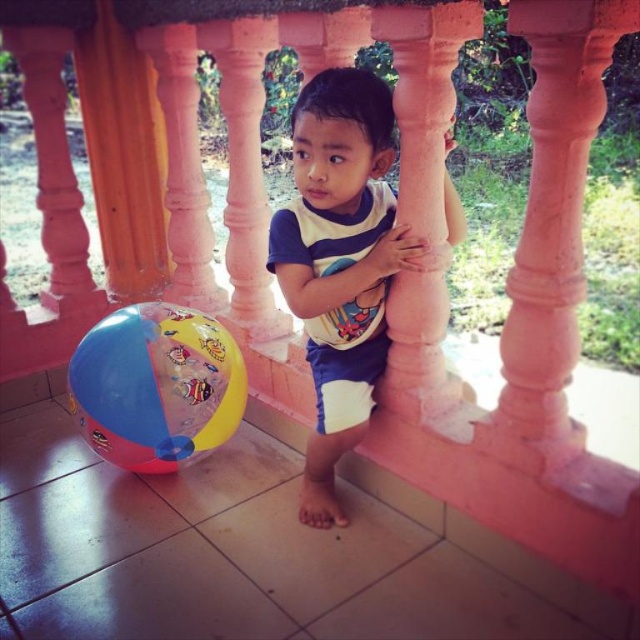
Can you confirm if white cotton shirt at center is wider than multicolored rubber ball at lower left?

Yes.

Does point (374, 102) come in front of point (108, 426)?

Yes, it is.

The width and height of the screenshot is (640, 640). Describe the element at coordinates (340, 262) in the screenshot. I see `white cotton shirt at center` at that location.

The image size is (640, 640). Find the location of `white cotton shirt at center`. white cotton shirt at center is located at coordinates (340, 262).